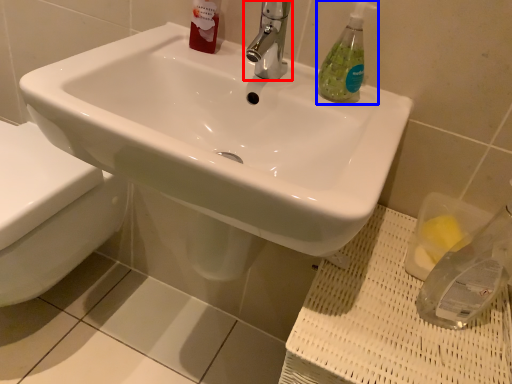
Question: Which point is closer to the camera, tap (highlighted by a red box) or soap dispenser (highlighted by a blue box)?

Choices:
 (A) tap
 (B) soap dispenser

Answer: (A)